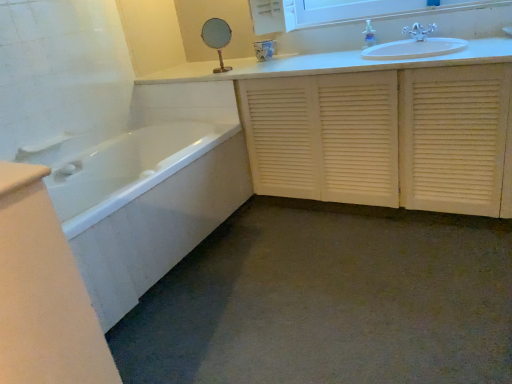
At what (x,y) coordinates should I click in order to perform the action: click on free spot to the right of clear plastic soap dispenser at upper center. Please return your answer as a coordinate pair (x, y). Looking at the image, I should click on (392, 37).